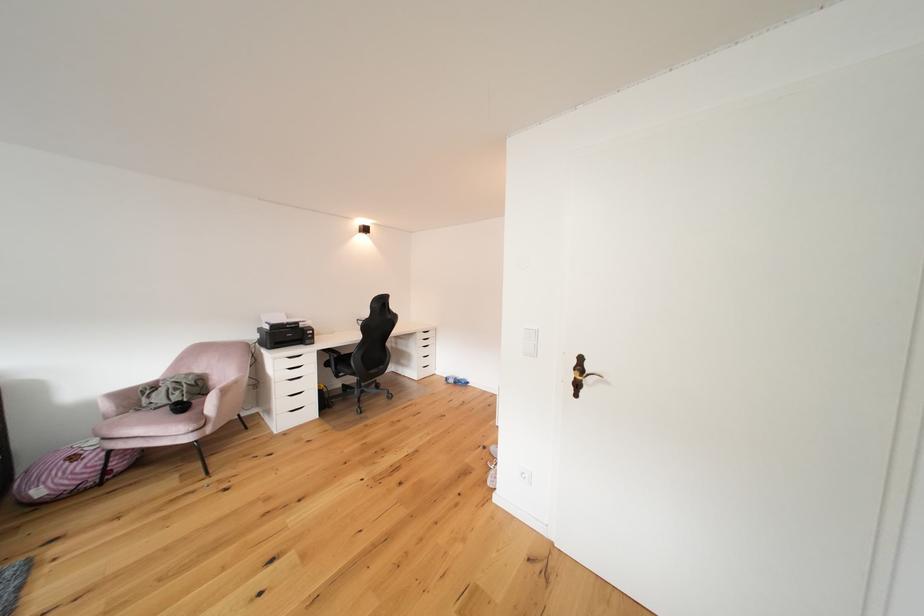
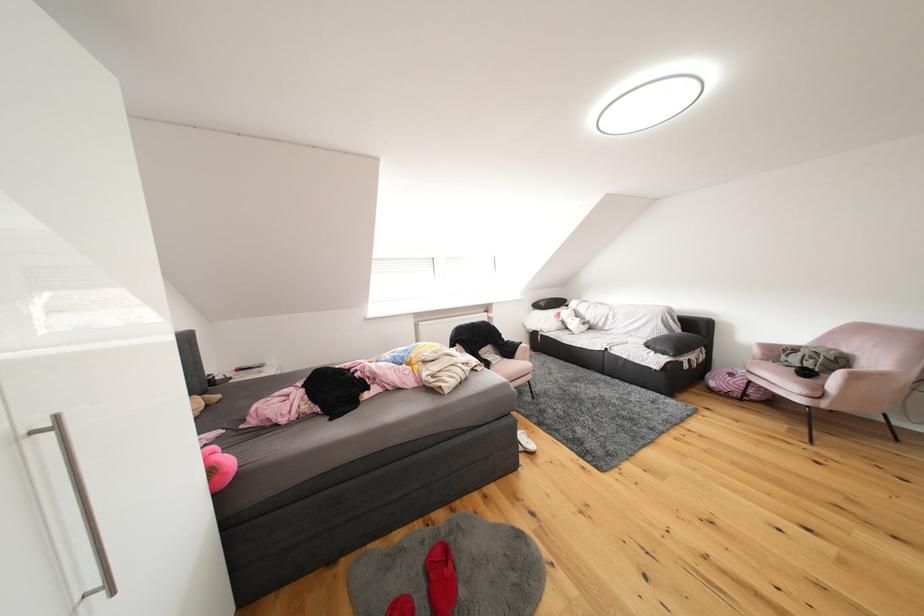
Find the pixel in the second image that matches point 116,410 in the first image.

(766, 355)